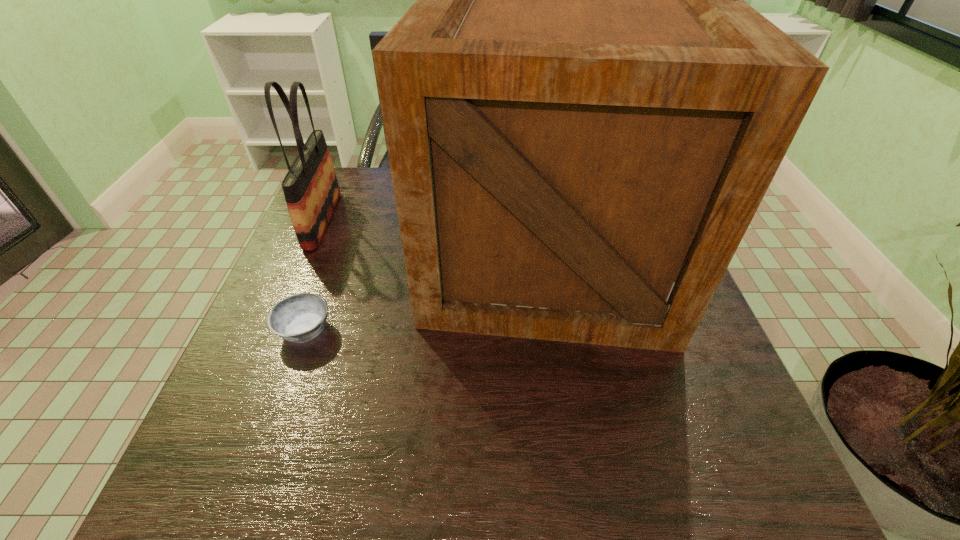
Locate an element on the screen. ashtray that is at the left edge is located at coordinates coord(299,318).

Where is `object that is at the right edge`? object that is at the right edge is located at coordinates (582, 115).

Where is `object positioned at the far left corner`? The width and height of the screenshot is (960, 540). object positioned at the far left corner is located at coordinates (311, 190).

The height and width of the screenshot is (540, 960). What are the coordinates of `object that is at the far right corner` in the screenshot? It's located at (582, 115).

The width and height of the screenshot is (960, 540). I want to click on vacant region at the near edge of the desktop, so click(x=572, y=480).

Locate an element on the screen. This screenshot has width=960, height=540. blank area at the left edge is located at coordinates (237, 404).

This screenshot has height=540, width=960. In the image, there is a desktop. Find the location of `vacant space at the far left corner`. vacant space at the far left corner is located at coordinates (370, 169).

In the image, there is a desktop. What are the coordinates of `blank space at the near left corner` in the screenshot? It's located at (283, 464).

I want to click on free space between the shopping bag and the ashtray, so click(x=314, y=275).

Image resolution: width=960 pixels, height=540 pixels. I want to click on blank region between the shopping bag and the shortest object, so click(x=314, y=275).